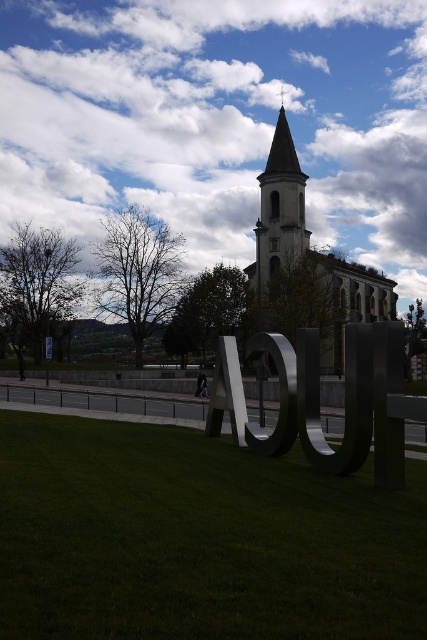
Question: Which point is closer to the camera?

Choices:
 (A) (257, 515)
 (B) (278, 253)
 (C) (46, 340)

Answer: (A)

Question: Is green grass at lower center closer to camera compared to smooth stone bell tower at center?

Choices:
 (A) no
 (B) yes

Answer: (B)

Question: Is smooth stone bell tower at center further to camera compared to brushed metal sign at center?

Choices:
 (A) no
 (B) yes

Answer: (B)

Question: Does green grass at lower center appear on the right side of brushed metal sign at center?

Choices:
 (A) no
 (B) yes

Answer: (B)

Question: Based on their relative distances, which object is nearer to the smooth stone bell tower at center?

Choices:
 (A) green grass at lower center
 (B) white stone church at center

Answer: (B)

Question: Which is farther from the brushed metal sign at center?

Choices:
 (A) green grass at lower center
 (B) smooth stone bell tower at center
 (C) white stone church at center

Answer: (C)